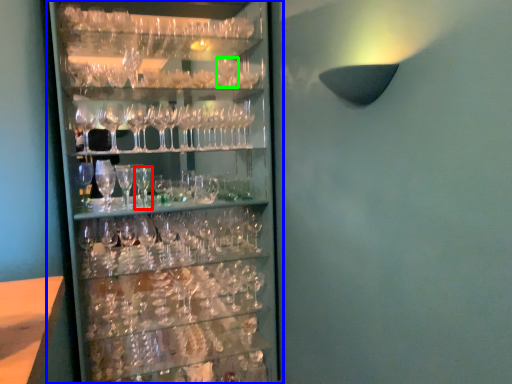
Question: Which is nearer to the beer glass (highlighted by a red box)? shelf (highlighted by a blue box) or wine glass (highlighted by a green box).

Choices:
 (A) shelf
 (B) wine glass

Answer: (A)